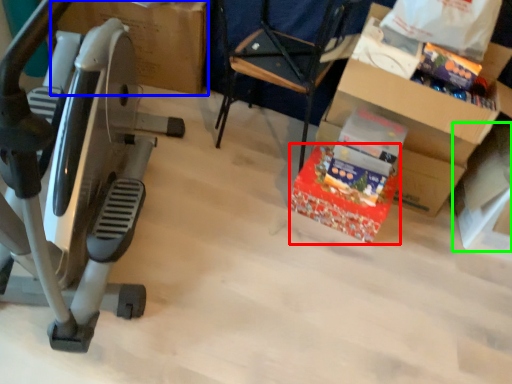
Question: Which object is the farthest from gift (highlighted by a red box)? Choose among these: cardboard box (highlighted by a blue box) or box (highlighted by a green box).

Choices:
 (A) cardboard box
 (B) box

Answer: (A)